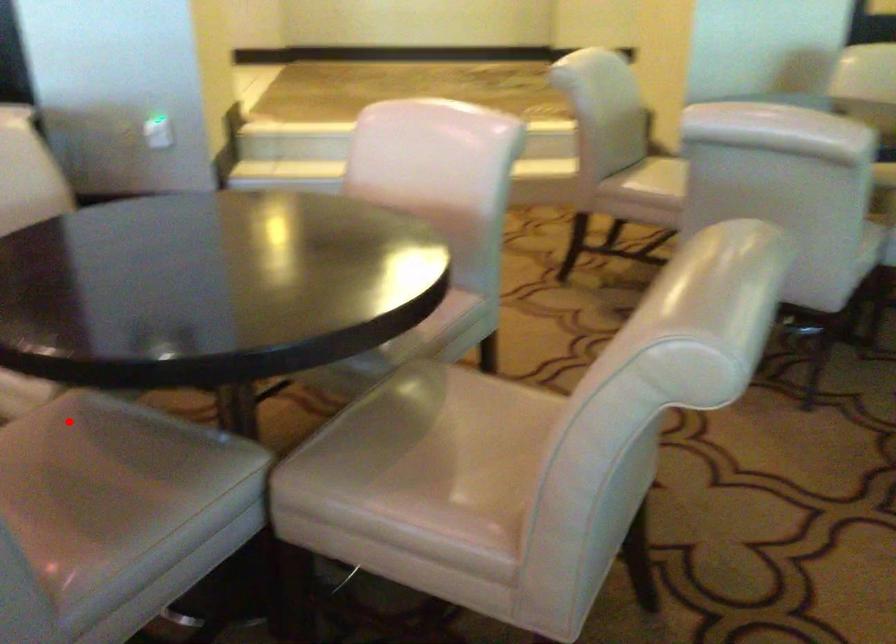
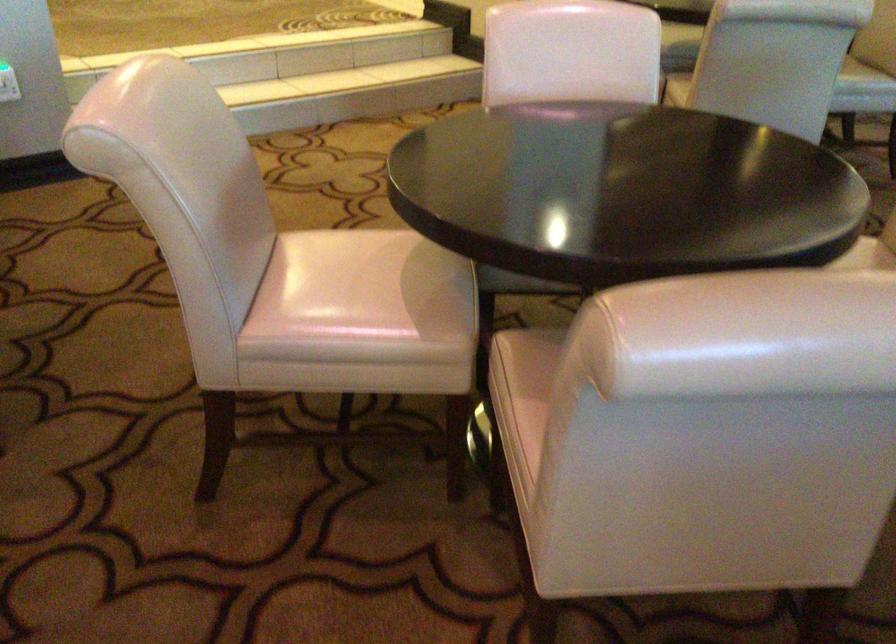
Find the pixel in the second image that matches the highlighted location in the first image.

(538, 351)